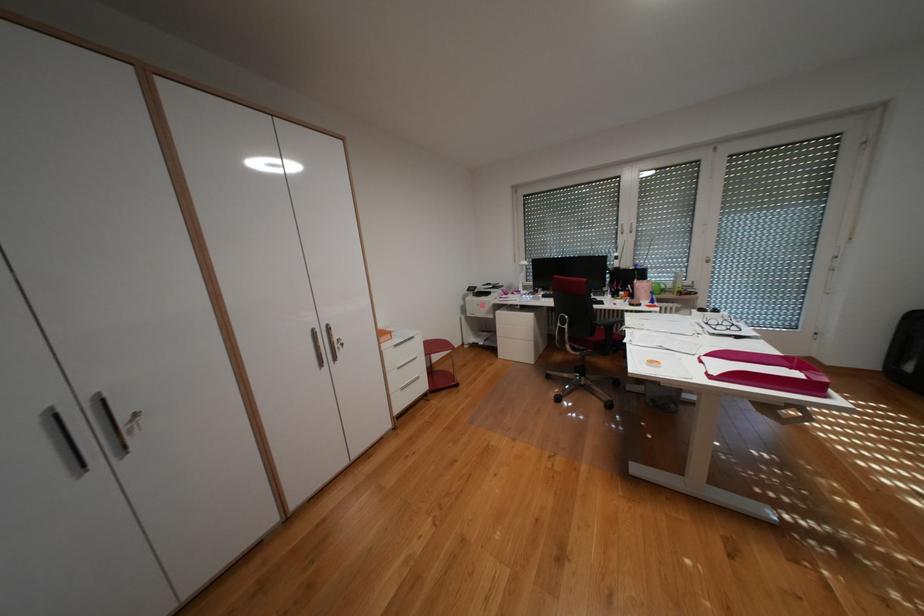
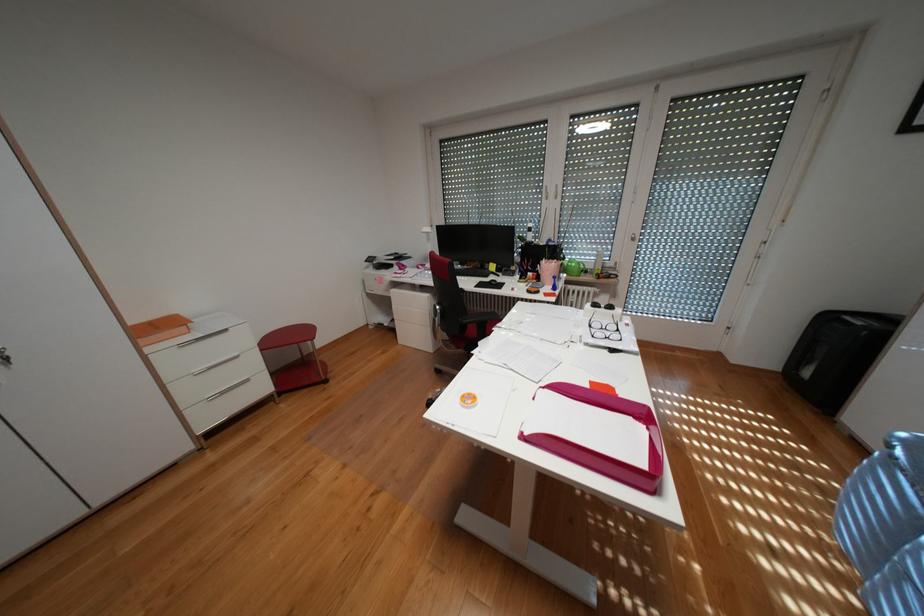
In the second image, find the point that corresponds to the point at 435,385 in the first image.

(274, 387)